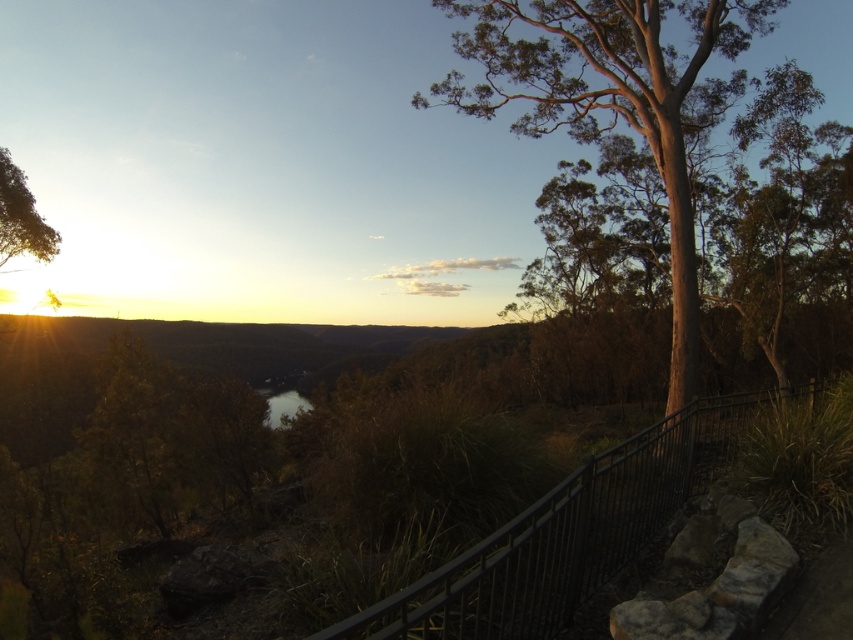
Is metallic black railing at center to the left of dark reflective water at center from the viewer's perspective?

No, metallic black railing at center is not to the left of dark reflective water at center.

Which of these two, metallic black railing at center or dark reflective water at center, stands taller?

dark reflective water at center

What are the coordinates of `metallic black railing at center` in the screenshot? It's located at (572, 531).

You are a GUI agent. You are given a task and a screenshot of the screen. Output one action in this format:
    pyautogui.click(x=<x>, y=<y>)
    Task: Click on the metallic black railing at center
    
    Given the screenshot: What is the action you would take?
    pyautogui.click(x=572, y=531)

Can you confirm if smooth bark tree at right is thinner than metallic black railing at center?

In fact, smooth bark tree at right might be wider than metallic black railing at center.

Is point (619, 104) positioned in front of point (395, 596)?

That is False.

Which is in front, point (671, 332) or point (717, 432)?

Point (717, 432)

Locate an element on the screen. The image size is (853, 640). smooth bark tree at right is located at coordinates (611, 99).

Which is behind, point (532, 116) or point (276, 397)?

Positioned behind is point (276, 397).

Which is more to the right, smooth bark tree at right or dark reflective water at center?

smooth bark tree at right

Does point (682, 60) lie in front of point (283, 412)?

Yes, it is in front of point (283, 412).

The height and width of the screenshot is (640, 853). I want to click on smooth bark tree at right, so (611, 99).